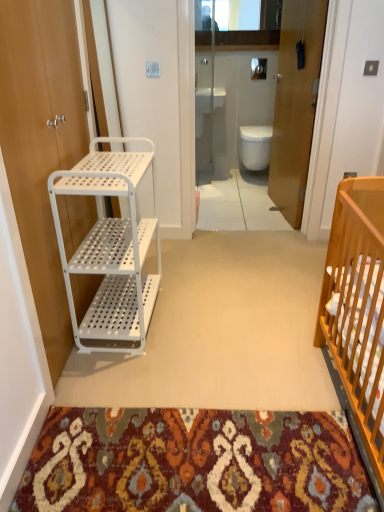
This screenshot has width=384, height=512. Describe the element at coordinates (255, 146) in the screenshot. I see `white glossy toilet at center` at that location.

Identify the location of white glossy toilet at center. This screenshot has height=512, width=384. (255, 146).

This screenshot has width=384, height=512. Describe the element at coordinates (41, 145) in the screenshot. I see `white matte door at left, the 1th door positioned from the left` at that location.

Where is `white glossy sink at upper center`? The image size is (384, 512). white glossy sink at upper center is located at coordinates (209, 99).

You are a GUI agent. You are given a task and a screenshot of the screen. Output one action in this format:
    pyautogui.click(x=<x>, y=<y>)
    Task: Click on the transparent glass door at center
    The image size is (384, 512).
    Given the screenshot: What is the action you would take?
    pyautogui.click(x=273, y=97)

Considering the sizes of white glossy sink at upper center and white matte door at left, the 2th door from the right, in the image, is white glossy sink at upper center taller or shorter than white matte door at left, the 2th door from the right,?

In the image, white glossy sink at upper center appears to be shorter than white matte door at left, the 2th door from the right.

Consider the image. Which of these two, white glossy sink at upper center or white matte door at left, acting as the 1th door starting from the front, is bigger?

white matte door at left, acting as the 1th door starting from the front, is bigger.

Measure the distance from white glossy sink at upper center to white matte door at left, the second door from the back.

white glossy sink at upper center and white matte door at left, the second door from the back, are 8.44 feet apart from each other.

Which object is positioned more to the right, white glossy sink at upper center or white matte door at left, the 2th door from the right?

white glossy sink at upper center is more to the right.

Is point (11, 189) behind point (306, 22)?

That is False.

How different are the orientations of white matte door at left, acting as the 1th door starting from the front, and wooden door at center, which appears as the 1th door when viewed from the back, in degrees?

The angular difference between white matte door at left, acting as the 1th door starting from the front, and wooden door at center, which appears as the 1th door when viewed from the back, is 172 degrees.

Is white matte door at left, the 1th door positioned from the left, smaller than wooden door at center, acting as the second door starting from the front?

Correct, white matte door at left, the 1th door positioned from the left, occupies less space than wooden door at center, acting as the second door starting from the front.

Between white matte door at left, the 2th door from the right, and wooden door at center, which appears as the 1th door when viewed from the back, which one has more height?

wooden door at center, which appears as the 1th door when viewed from the back.

Can you confirm if transparent glass door at center is smaller than white perforated shelving unit at left?

Actually, transparent glass door at center might be larger than white perforated shelving unit at left.

Is transparent glass door at center aimed at white perforated shelving unit at left?

No, transparent glass door at center is not turned towards white perforated shelving unit at left.

From the image's perspective, would you say transparent glass door at center is positioned over white perforated shelving unit at left?

Indeed, from the image's perspective, transparent glass door at center is shown above white perforated shelving unit at left.

Would you say transparent glass door at center is inside or outside white perforated shelving unit at left?

transparent glass door at center cannot be found inside white perforated shelving unit at left.

Considering the sizes of white matte door at left, the 2th door from the right, and white glossy toilet at center in the image, is white matte door at left, the 2th door from the right, bigger or smaller than white glossy toilet at center?

Considering their sizes, white matte door at left, the 2th door from the right, takes up more space than white glossy toilet at center.

Considering the sizes of objects white matte door at left, the second door from the back, and white glossy toilet at center in the image provided, who is wider, white matte door at left, the second door from the back, or white glossy toilet at center?

white glossy toilet at center is wider.

Is white matte door at left, the second door from the back, facing away from white glossy toilet at center?

No, white matte door at left, the second door from the back, is not facing away from white glossy toilet at center.

Which object is closer to the camera, white matte door at left, the 1th door positioned from the left, or white glossy toilet at center?

Positioned in front is white matte door at left, the 1th door positioned from the left.

Consider the image. From the image's perspective, does wooden door at center, which appears as the 1th door when viewed from the back, appear higher than white matte door at left, the 1th door positioned from the left?

Yes, from the image's perspective, wooden door at center, which appears as the 1th door when viewed from the back, is on top of white matte door at left, the 1th door positioned from the left.

Considering the relative positions of wooden door at center, acting as the second door starting from the front, and white matte door at left, the second door from the back, in the image provided, is wooden door at center, acting as the second door starting from the front, to the left of white matte door at left, the second door from the back, from the viewer's perspective?

Incorrect, wooden door at center, acting as the second door starting from the front, is not on the left side of white matte door at left, the second door from the back.

From a real-world perspective, between wooden door at center, which is the second door in left-to-right order, and white matte door at left, the 2th door from the right, who is vertically higher?

From a 3D spatial view, wooden door at center, which is the second door in left-to-right order, is above.

Measure the distance between wooden door at center, which is the second door in left-to-right order, and white matte door at left, the 2th door from the right.

wooden door at center, which is the second door in left-to-right order, is 1.78 meters from white matte door at left, the 2th door from the right.

Is transparent glass door at center in contact with white matte door at left, acting as the 1th door starting from the front?

They are not placed beside each other.

Is white matte door at left, the 2th door from the right, completely or partially inside transparent glass door at center?

That's incorrect, white matte door at left, the 2th door from the right, is not inside transparent glass door at center.

Does transparent glass door at center have a greater height compared to white matte door at left, acting as the 1th door starting from the front?

Indeed, transparent glass door at center has a greater height compared to white matte door at left, acting as the 1th door starting from the front.

Is white glossy sink at upper center not inside white perforated shelving unit at left?

Yes, white glossy sink at upper center is outside of white perforated shelving unit at left.

From a real-world perspective, which is physically below, white glossy sink at upper center or white perforated shelving unit at left?

white perforated shelving unit at left is physically lower.

Is white glossy sink at upper center with white perforated shelving unit at left?

white glossy sink at upper center is not next to white perforated shelving unit at left, and they're not touching.

Who is taller, white glossy sink at upper center or white perforated shelving unit at left?

white perforated shelving unit at left.

I want to click on sink lying above the white matte door at left, the 2th door from the right (from the image's perspective), so click(209, 99).

Identify the location of door below the wooden door at center, acting as the second door starting from the front (from the image's perspective). Image resolution: width=384 pixels, height=512 pixels. (41, 145).

Estimate the real-world distances between objects in this image. Which object is closer to white glossy toilet at center, white perforated shelving unit at left or white glossy sink at upper center?

white glossy sink at upper center is closer to white glossy toilet at center.

Looking at the image, which one is located further to transparent glass door at center, white matte door at left, the second door from the back, or white glossy sink at upper center?

white matte door at left, the second door from the back, lies further to transparent glass door at center than the other object.

Looking at the image, which one is located closer to white glossy toilet at center, transparent glass door at center or white glossy sink at upper center?

Among the two, white glossy sink at upper center is located nearer to white glossy toilet at center.

From the image, which object appears to be farther from transparent glass door at center, white perforated shelving unit at left or white matte door at left, the 1th door positioned from the left?

Among the two, white matte door at left, the 1th door positioned from the left, is located further to transparent glass door at center.

From the image, which object appears to be farther from wooden door at center, acting as the second door starting from the front, transparent glass door at center or white perforated shelving unit at left?

Based on the image, white perforated shelving unit at left appears to be further to wooden door at center, acting as the second door starting from the front.

Looking at the image, which one is located further to transparent glass door at center, wooden door at center, acting as the second door starting from the front, or white glossy toilet at center?

The object further to transparent glass door at center is white glossy toilet at center.

Looking at the image, which one is located closer to white matte door at left, acting as the 1th door starting from the front, white perforated shelving unit at left or white glossy sink at upper center?

white perforated shelving unit at left.

Looking at the image, which one is located closer to wooden door at center, acting as the second door starting from the front, white glossy toilet at center or white matte door at left, the 2th door from the right?

white glossy toilet at center lies closer to wooden door at center, acting as the second door starting from the front, than the other object.

At what (x,y) coordinates should I click in order to perform the action: click on glass door located between white matte door at left, the 1th door positioned from the left, and white glossy toilet at center in the depth direction. Please return your answer as a coordinate pair (x, y). Looking at the image, I should click on (273, 97).

At what (x,y) coordinates should I click in order to perform the action: click on door located between white perforated shelving unit at left and white glossy sink at upper center in the depth direction. Please return your answer as a coordinate pair (x, y). Image resolution: width=384 pixels, height=512 pixels. Looking at the image, I should click on (295, 103).

Locate an element on the screen. This screenshot has width=384, height=512. sink located between transparent glass door at center and white glossy toilet at center in the depth direction is located at coordinates (209, 99).

Find the location of a particular element. glass door positioned between white matte door at left, acting as the 1th door starting from the front, and white glossy sink at upper center from near to far is located at coordinates (273, 97).